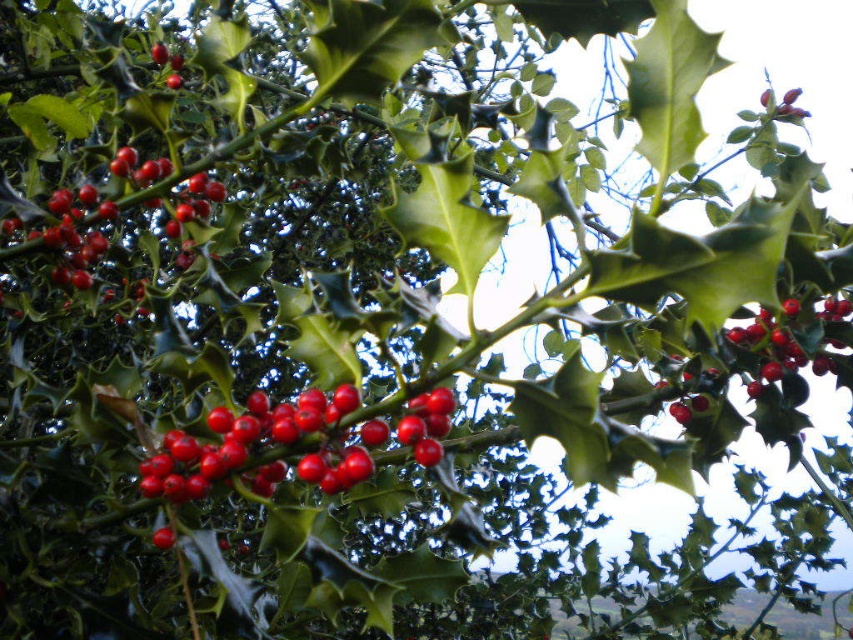
Does glossy red berries at upper right appear over glossy red berry at center?

Actually, glossy red berries at upper right is below glossy red berry at center.

Describe the element at coordinates (790, 344) in the screenshot. This screenshot has width=853, height=640. I see `glossy red berries at upper right` at that location.

Between point (792, 305) and point (170, 81), which one is positioned in front?

Point (792, 305)

Locate an element on the screen. glossy red berries at upper right is located at coordinates (790, 344).

Who is positioned more to the right, glossy red berries at upper right or glossy red berries at upper left?

glossy red berries at upper right

Does glossy red berries at upper right appear over glossy red berries at upper left?

No, glossy red berries at upper right is not above glossy red berries at upper left.

Is point (833, 362) less distant than point (112, 214)?

Yes, it is.

Identify the location of glossy red berries at upper right. (790, 344).

Between glossy red berries at center and glossy red berries at upper left, which one has less height?

With less height is glossy red berries at center.

From the picture: Is glossy red berries at center further to the viewer compared to glossy red berries at upper left?

No, it is in front of glossy red berries at upper left.

Locate an element on the screen. This screenshot has height=640, width=853. glossy red berries at center is located at coordinates (265, 442).